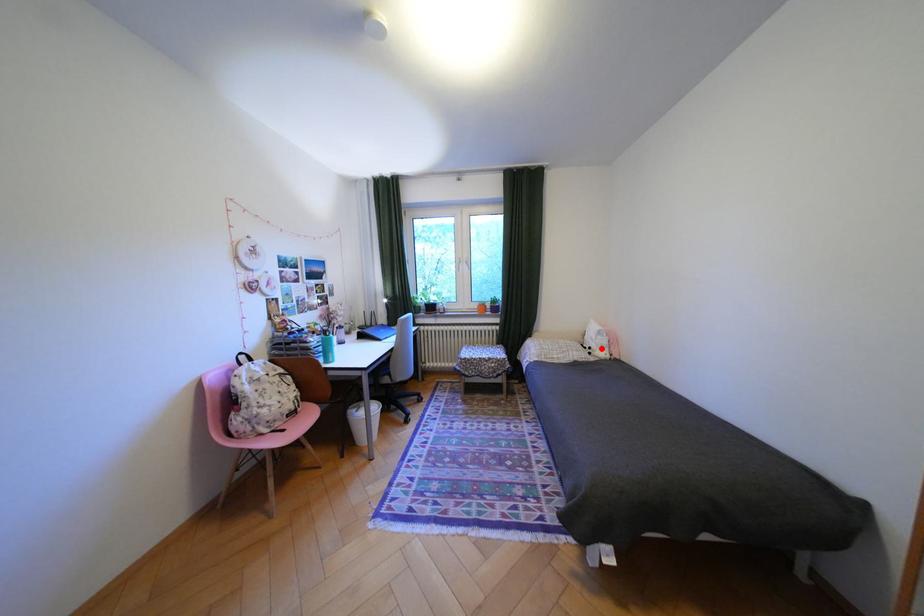
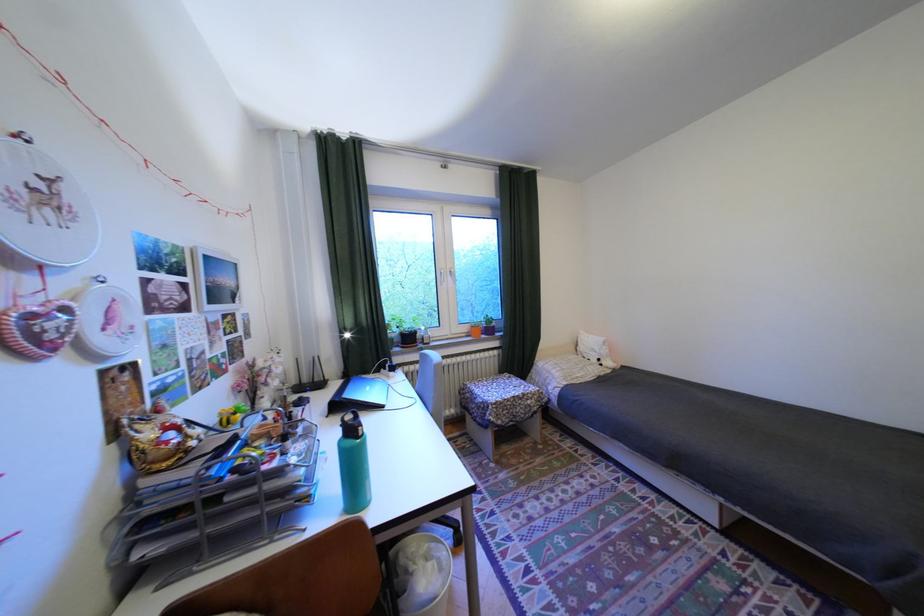
Where in the second image is the point corresponding to the highlighted location from the first image?

(611, 360)